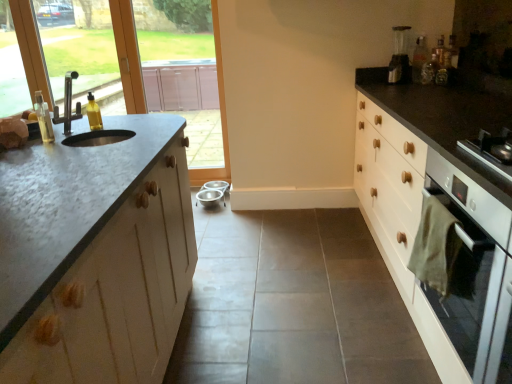
What do you see at coordinates (463, 282) in the screenshot? I see `white glossy oven at right` at bounding box center [463, 282].

The image size is (512, 384). What do you see at coordinates (212, 193) in the screenshot?
I see `metallic stainless steel bowls at center` at bounding box center [212, 193].

Find the location of a particular element. The width and height of the screenshot is (512, 384). metallic stainless steel bowls at center is located at coordinates (212, 193).

Describe the element at coordinates (419, 58) in the screenshot. I see `translucent plastic bottle at upper right, the 1th bottle from the back` at that location.

What is the approximate height of translucent plastic bottle at upper right, which is the 3th bottle from left to right?

It is 10.53 inches.

The height and width of the screenshot is (384, 512). What do you see at coordinates (77, 43) in the screenshot? I see `transparent glass window at upper left, arranged as the first window screen when viewed from the left` at bounding box center [77, 43].

This screenshot has width=512, height=384. Describe the element at coordinates (93, 113) in the screenshot. I see `yellow translucent bottle at left, placed as the second bottle when sorted from right to left` at that location.

The width and height of the screenshot is (512, 384). What are the coordinates of `matte glass window screen at upper left, which is counted as the 2th window screen, starting from the left` in the screenshot? It's located at (186, 73).

What do you see at coordinates (186, 73) in the screenshot? I see `matte glass window screen at upper left, the 1th window screen from the right` at bounding box center [186, 73].

Find the location of `white glossy oven at right`. white glossy oven at right is located at coordinates (463, 282).

Considering the points (93, 99) and (478, 241), which point is behind, point (93, 99) or point (478, 241)?

The point (93, 99) is farther from the camera.

Considering the positions of objects yellow translucent bottle at left, which is counted as the second bottle, starting from the left, and white glossy oven at right in the image provided, who is more to the right, yellow translucent bottle at left, which is counted as the second bottle, starting from the left, or white glossy oven at right?

From the viewer's perspective, white glossy oven at right appears more on the right side.

Would you say yellow translucent bottle at left, arranged as the second bottle when viewed from the front, is outside white glossy oven at right?

yellow translucent bottle at left, arranged as the second bottle when viewed from the front, lies outside white glossy oven at right's area.

How distant is yellow translucent bottle at left, the second bottle in the bottom-to-top sequence, from white glossy oven at right?

yellow translucent bottle at left, the second bottle in the bottom-to-top sequence, is 1.57 meters away from white glossy oven at right.

Is white glossy oven at right to the left or to the right of metallic stainless steel bowls at center in the image?

In the image, white glossy oven at right appears on the right side of metallic stainless steel bowls at center.

Which is in front, point (495, 304) or point (204, 203)?

The point (495, 304) is in front.

Is white glossy oven at right facing towards metallic stainless steel bowls at center?

No, white glossy oven at right is not turned towards metallic stainless steel bowls at center.

Considering the relative sizes of white glossy oven at right and metallic stainless steel bowls at center in the image provided, is white glossy oven at right wider than metallic stainless steel bowls at center?

Correct, the width of white glossy oven at right exceeds that of metallic stainless steel bowls at center.

From a real-world perspective, which object rests below the other?

In real-world perspective, metallic stainless steel bowls at center is lower.

Considering the points (225, 205) and (91, 109), which point is behind, point (225, 205) or point (91, 109)?

The point (225, 205) is farther from the camera.

Who is bigger, metallic stainless steel bowls at center or yellow translucent bottle at left, the 2th bottle when ordered from back to front?

metallic stainless steel bowls at center.

Considering the sizes of objects metallic stainless steel bowls at center and yellow translucent bottle at left, which is counted as the second bottle, starting from the left, in the image provided, who is taller, metallic stainless steel bowls at center or yellow translucent bottle at left, which is counted as the second bottle, starting from the left,?

yellow translucent bottle at left, which is counted as the second bottle, starting from the left.

Are matte glass window screen at upper left, the 1th window screen from the right, and metallic silver coffee machine at upper right located far from each other?

Yes.

Which object is positioned more to the left, matte glass window screen at upper left, the 1th window screen from the right, or metallic silver coffee machine at upper right?

Positioned to the left is matte glass window screen at upper left, the 1th window screen from the right.

Between point (143, 1) and point (404, 32), which one is positioned in front?

The point (404, 32) is in front.

Could you tell me if matte glass window screen at upper left, which is counted as the 2th window screen, starting from the left, is turned towards metallic silver coffee machine at upper right?

No, matte glass window screen at upper left, which is counted as the 2th window screen, starting from the left, is not turned towards metallic silver coffee machine at upper right.

Can you confirm if yellow translucent bottle at left, arranged as the second bottle when viewed from the front, is shorter than metallic stainless steel bowls at center?

No.

From a real-world perspective, which object stands above the other?

From a 3D spatial view, yellow translucent bottle at left, the 2th bottle when ordered from back to front, is above.

Is yellow translucent bottle at left, the 2th bottle when ordered from back to front, positioned with its back to metallic stainless steel bowls at center?

No, yellow translucent bottle at left, the 2th bottle when ordered from back to front, is not facing the opposite direction of metallic stainless steel bowls at center.

From the image's perspective, which is below, yellow translucent bottle at left, which is counted as the 2th bottle, starting from the top, or metallic stainless steel bowls at center?

metallic stainless steel bowls at center is shown below in the image.

Is matte glass window screen at upper left, the 1th window screen from the right, facing towards yellow translucent bottle at left, the second bottle in the bottom-to-top sequence?

Yes.

Measure the distance from matte glass window screen at upper left, the 1th window screen from the right, to yellow translucent bottle at left, placed as the second bottle when sorted from right to left.

matte glass window screen at upper left, the 1th window screen from the right, and yellow translucent bottle at left, placed as the second bottle when sorted from right to left, are 3.17 meters apart.

Is matte glass window screen at upper left, which is counted as the 2th window screen, starting from the left, taller or shorter than yellow translucent bottle at left, which is counted as the second bottle, starting from the left?

In the image, matte glass window screen at upper left, which is counted as the 2th window screen, starting from the left, appears to be taller than yellow translucent bottle at left, which is counted as the second bottle, starting from the left.

How many degrees apart are the facing directions of matte glass window screen at upper left, which is counted as the 2th window screen, starting from the left, and yellow translucent bottle at left, which is counted as the 2th bottle, starting from the top?

They differ by 49 degrees in their facing directions.

Is translucent plastic soap dispenser at left, the 1th bottle from the bottom, completely or partially outside of stainless steel sink at left?

No, translucent plastic soap dispenser at left, the 1th bottle from the bottom, is inside stainless steel sink at left's boundary.

Considering the sizes of translucent plastic soap dispenser at left, positioned as the 1th bottle in front-to-back order, and stainless steel sink at left in the image, is translucent plastic soap dispenser at left, positioned as the 1th bottle in front-to-back order, taller or shorter than stainless steel sink at left?

In the image, translucent plastic soap dispenser at left, positioned as the 1th bottle in front-to-back order, appears to be shorter than stainless steel sink at left.

Is translucent plastic soap dispenser at left, which is the third bottle from right to left, not close to stainless steel sink at left?

No, there isn't a large distance between translucent plastic soap dispenser at left, which is the third bottle from right to left, and stainless steel sink at left.

From a real-world perspective, is translucent plastic soap dispenser at left, positioned as the 1th bottle in front-to-back order, physically below stainless steel sink at left?

Yes.

Find the location of `screen door that is below the yellow translucent bottle at left, placed as the second bottle when sorted from right to left (from the image's perspective)`. screen door that is below the yellow translucent bottle at left, placed as the second bottle when sorted from right to left (from the image's perspective) is located at coordinates (463, 282).

Image resolution: width=512 pixels, height=384 pixels. Find the location of `screen door on the right of metallic stainless steel bowls at center`. screen door on the right of metallic stainless steel bowls at center is located at coordinates (x=463, y=282).

Considering their positions, is white glossy oven at right positioned closer to metallic silver coffee machine at upper right than stainless steel sink at left?

white glossy oven at right is closer to metallic silver coffee machine at upper right.

Based on the photo, considering their positions, is metallic silver coffee machine at upper right positioned further to white glossy oven at right than transparent glass window at upper left, arranged as the first window screen when viewed from the left?

transparent glass window at upper left, arranged as the first window screen when viewed from the left.

From the image, which object appears to be nearer to matte glass window screen at upper left, which is counted as the 2th window screen, starting from the left, translucent plastic soap dispenser at left, the 3th bottle positioned from the back, or transparent glass window at upper left, which appears as the second window screen when viewed from the right?

transparent glass window at upper left, which appears as the second window screen when viewed from the right, is positioned closer to the anchor matte glass window screen at upper left, which is counted as the 2th window screen, starting from the left.

Estimate the real-world distances between objects in this image. Which object is further from metallic silver coffee machine at upper right, white glossy oven at right or translucent plastic soap dispenser at left, the 1th bottle when ordered from left to right?

Based on the image, translucent plastic soap dispenser at left, the 1th bottle when ordered from left to right, appears to be further to metallic silver coffee machine at upper right.

Estimate the real-world distances between objects in this image. Which object is further from transparent glass window at upper left, which appears as the second window screen when viewed from the right, translucent plastic bottle at upper right, which appears as the first bottle when viewed from the right, or metallic silver coffee machine at upper right?

translucent plastic bottle at upper right, which appears as the first bottle when viewed from the right, is further to transparent glass window at upper left, which appears as the second window screen when viewed from the right.

Which object lies nearer to the anchor point yellow translucent bottle at left, the second bottle in the bottom-to-top sequence, translucent plastic soap dispenser at left, the 3th bottle positioned from the back, or translucent plastic bottle at upper right, which is counted as the third bottle, starting from the bottom?

translucent plastic soap dispenser at left, the 3th bottle positioned from the back.

When comparing their distances from transparent glass window at upper left, arranged as the first window screen when viewed from the left, does metallic stainless steel bowls at center or matte glass window screen at upper left, the 1th window screen from the right, seem closer?

matte glass window screen at upper left, the 1th window screen from the right.

Based on their spatial positions, is yellow translucent bottle at left, the second bottle in the bottom-to-top sequence, or matte glass window screen at upper left, which is counted as the 2th window screen, starting from the left, closer to white glossy oven at right?

The object closer to white glossy oven at right is yellow translucent bottle at left, the second bottle in the bottom-to-top sequence.

Where is `window screen situated between transparent glass window at upper left, arranged as the first window screen when viewed from the left, and translucent plastic bottle at upper right, positioned as the third bottle in front-to-back order, from left to right`? window screen situated between transparent glass window at upper left, arranged as the first window screen when viewed from the left, and translucent plastic bottle at upper right, positioned as the third bottle in front-to-back order, from left to right is located at coordinates (186, 73).

You are a GUI agent. You are given a task and a screenshot of the screen. Output one action in this format:
    pyautogui.click(x=<x>, y=<y>)
    Task: Click on the window screen between stainless steel sink at left and metallic silver coffee machine at upper right in the horizontal direction
    
    Given the screenshot: What is the action you would take?
    pyautogui.click(x=186, y=73)

The image size is (512, 384). In order to click on bottle between stainless steel sink at left and translucent plastic bottle at upper right, positioned as the third bottle in front-to-back order, from left to right in this screenshot , I will do `click(93, 113)`.

The height and width of the screenshot is (384, 512). In order to click on window screen between translucent plastic soap dispenser at left, which is the third bottle from right to left, and translucent plastic bottle at upper right, which appears as the first bottle when viewed from the right, from left to right in this screenshot , I will do `click(186, 73)`.